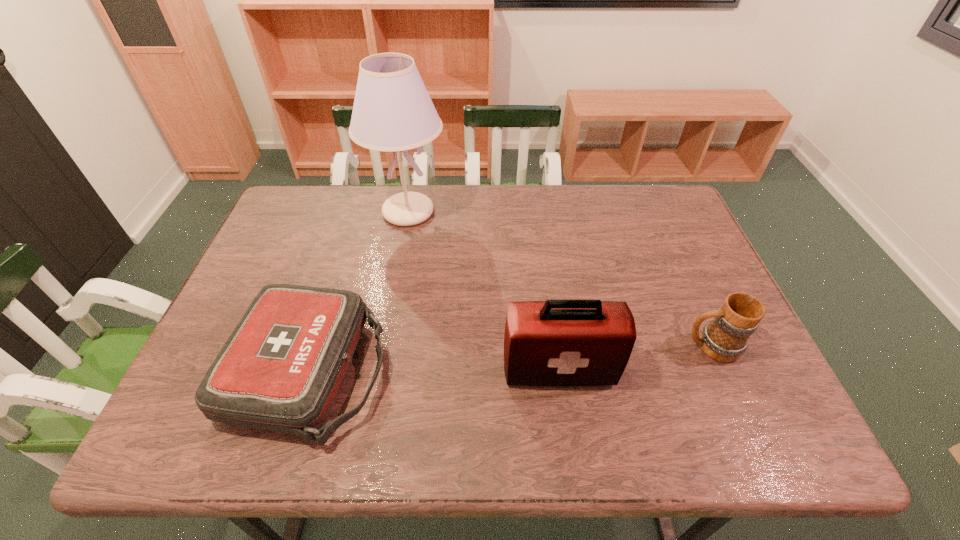
The image size is (960, 540). I want to click on free space that is in between the mug and the farthest object, so click(560, 279).

Find the location of a particular element. The height and width of the screenshot is (540, 960). free spot between the rightmost object and the third shortest object is located at coordinates (635, 358).

Locate an element on the screen. The height and width of the screenshot is (540, 960). object that is the third closest to the shortest object is located at coordinates (725, 338).

Select which object is the third closest to the taller first-aid kit. Please provide its 2D coordinates. Your answer should be formatted as a tuple, i.e. [(x, y)], where the tuple contains the x and y coordinates of a point satisfying the conditions above.

[(392, 112)]